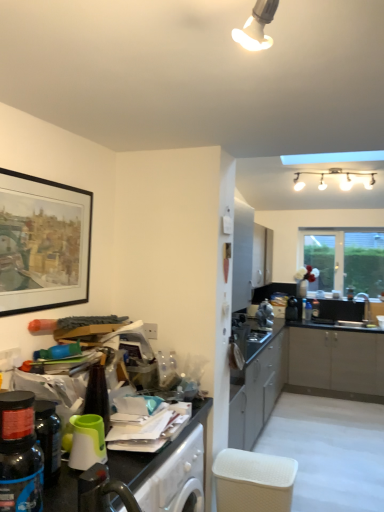
Where is `black plastic toaster at center-right, positioned as the 3th appliance in left-to-right order`? Image resolution: width=384 pixels, height=512 pixels. black plastic toaster at center-right, positioned as the 3th appliance in left-to-right order is located at coordinates (292, 309).

How much space does green plastic cup at lower left, the third appliance positioned from the right, occupy vertically?

green plastic cup at lower left, the third appliance positioned from the right, is 18.29 centimeters in height.

Locate an element on the screen. The width and height of the screenshot is (384, 512). green plastic cup at lower left, the third appliance positioned from the right is located at coordinates (87, 442).

Describe the element at coordinates (265, 314) in the screenshot. This screenshot has width=384, height=512. I see `satin silver toaster at center-right, the second appliance positioned from the left` at that location.

Where is `satin silver toaster at center-right, the second appliance positioned from the left`? Image resolution: width=384 pixels, height=512 pixels. satin silver toaster at center-right, the second appliance positioned from the left is located at coordinates 265,314.

This screenshot has height=512, width=384. Describe the element at coordinates (19, 455) in the screenshot. I see `translucent plastic bottle at lower left` at that location.

The height and width of the screenshot is (512, 384). Describe the element at coordinates (335, 175) in the screenshot. I see `white glossy light fixture at upper right` at that location.

You are a GUI agent. You are given a task and a screenshot of the screen. Output one action in this format:
    pyautogui.click(x=<x>, y=<y>)
    Task: Click on the black plastic toaster at center-right, the 3th appliance when ordered from front to back
    This screenshot has height=512, width=384.
    Given the screenshot: What is the action you would take?
    pyautogui.click(x=292, y=309)

Between translucent plastic bottle at lower left and green plastic cup at lower left, placed as the third appliance when sorted from back to front, which one has larger size?

With larger size is translucent plastic bottle at lower left.

Between translucent plastic bottle at lower left and green plastic cup at lower left, the third appliance positioned from the right, which one has less height?

With less height is green plastic cup at lower left, the third appliance positioned from the right.

In the scene shown: Can you see translucent plastic bottle at lower left touching green plastic cup at lower left, marked as the first appliance in a left-to-right arrangement?

No, translucent plastic bottle at lower left is not in contact with green plastic cup at lower left, marked as the first appliance in a left-to-right arrangement.

Is point (358, 271) more distant than point (296, 316)?

That is True.

From the image's perspective, does clear glass window at upper right appear lower than black plastic toaster at center-right, the 3th appliance when ordered from front to back?

Actually, clear glass window at upper right appears above black plastic toaster at center-right, the 3th appliance when ordered from front to back, in the image.

Is clear glass window at upper right oriented towards black plastic toaster at center-right, which is the 1th appliance in back-to-front order?

Yes.

Is clear glass window at upper right shorter than black plastic toaster at center-right, which is the 1th appliance in back-to-front order?

Incorrect, the height of clear glass window at upper right does not fall short of that of black plastic toaster at center-right, which is the 1th appliance in back-to-front order.

Which object is thinner, white glossy light fixture at upper right or black matte picture frame at left?

Thinner between the two is black matte picture frame at left.

Relative to black matte picture frame at left, is white glossy light fixture at upper right in front or behind?

Visually, white glossy light fixture at upper right is located behind black matte picture frame at left.

Looking at this image, considering the relative positions of white glossy light fixture at upper right and black matte picture frame at left in the image provided, is white glossy light fixture at upper right to the left of black matte picture frame at left from the viewer's perspective?

No, white glossy light fixture at upper right is not to the left of black matte picture frame at left.

Based on the photo, is black matte picture frame at left surrounded by white glossy light fixture at upper right?

No, white glossy light fixture at upper right does not contain black matte picture frame at left.

Based on the photo, is satin silver toaster at center-right, which is the second appliance from back to front, oriented towards green plastic cup at lower left, arranged as the 1th appliance when viewed from the front?

No, satin silver toaster at center-right, which is the second appliance from back to front, is not aimed at green plastic cup at lower left, arranged as the 1th appliance when viewed from the front.

From the picture: Which point is more distant from viewer, (257, 316) or (92, 423)?

The point (257, 316) is more distant.

Can you confirm if satin silver toaster at center-right, the second appliance positioned from the left, is wider than green plastic cup at lower left, marked as the first appliance in a left-to-right arrangement?

Yes, satin silver toaster at center-right, the second appliance positioned from the left, is wider than green plastic cup at lower left, marked as the first appliance in a left-to-right arrangement.

Which of these two, white textured basket at lower center or black matte picture frame at left, stands shorter?

With less height is white textured basket at lower center.

Is black matte picture frame at left inside white textured basket at lower center?

That's incorrect, black matte picture frame at left is not inside white textured basket at lower center.

From the image's perspective, relative to black matte picture frame at left, is white textured basket at lower center above or below?

Clearly, from the image's perspective, white textured basket at lower center is below black matte picture frame at left.

Is point (239, 475) farther from viewer compared to point (68, 223)?

Yes, point (239, 475) is behind point (68, 223).

Are white glossy light fixture at upper right and white textured basket at lower center beside each other?

They are not placed beside each other.

From the picture: Which is less distant, (336, 170) or (235, 482)?

Point (336, 170) appears to be farther away from the viewer than point (235, 482).

Does white glossy light fixture at upper right have a lesser height compared to white textured basket at lower center?

Indeed, white glossy light fixture at upper right has a lesser height compared to white textured basket at lower center.

Which is more to the left, white glossy light fixture at upper right or white textured basket at lower center?

Positioned to the left is white textured basket at lower center.

Can you see black matte picture frame at left touching translucent plastic bottle at lower left?

black matte picture frame at left is not next to translucent plastic bottle at lower left, and they're not touching.

From a real-world perspective, which object stands above the other?

black matte picture frame at left is physically above.

Is black matte picture frame at left situated inside translucent plastic bottle at lower left or outside?

black matte picture frame at left lies outside translucent plastic bottle at lower left.

Could you tell me if black matte picture frame at left is turned towards translucent plastic bottle at lower left?

No, black matte picture frame at left does not turn towards translucent plastic bottle at lower left.

The height and width of the screenshot is (512, 384). Find the location of `bottle in front of the green plastic cup at lower left, arranged as the 1th appliance when viewed from the front`. bottle in front of the green plastic cup at lower left, arranged as the 1th appliance when viewed from the front is located at coordinates pos(19,455).

Image resolution: width=384 pixels, height=512 pixels. Identify the location of the 2nd appliance positioned below the clear glass window at upper right (from a real-world perspective). (292, 309).

Which object lies nearer to the anchor point black matte picture frame at left, satin silver toaster at center-right, which ranks as the 2th appliance in right-to-left order, or green plastic cup at lower left, marked as the first appliance in a left-to-right arrangement?

Based on the image, green plastic cup at lower left, marked as the first appliance in a left-to-right arrangement, appears to be nearer to black matte picture frame at left.

Looking at the image, which one is located further to white glossy light fixture at upper right, satin silver toaster at center-right, the second appliance positioned from the left, or black matte picture frame at left?

The object further to white glossy light fixture at upper right is black matte picture frame at left.

Estimate the real-world distances between objects in this image. Which object is closer to green plastic cup at lower left, the third appliance positioned from the right, black plastic toaster at center-right, positioned as the 3th appliance in left-to-right order, or white textured basket at lower center?

Among the two, white textured basket at lower center is located nearer to green plastic cup at lower left, the third appliance positioned from the right.

Which object lies nearer to the anchor point satin silver toaster at center-right, the 2th appliance viewed from the front, black matte picture frame at left or white glossy light fixture at upper right?

Based on the image, white glossy light fixture at upper right appears to be nearer to satin silver toaster at center-right, the 2th appliance viewed from the front.

Based on their spatial positions, is satin silver toaster at center-right, the second appliance positioned from the left, or green plastic cup at lower left, placed as the third appliance when sorted from back to front, closer to translucent plastic bottle at lower left?

Based on the image, green plastic cup at lower left, placed as the third appliance when sorted from back to front, appears to be nearer to translucent plastic bottle at lower left.

Based on their spatial positions, is black plastic toaster at center-right, the 3th appliance when ordered from front to back, or green plastic cup at lower left, marked as the first appliance in a left-to-right arrangement, further from black matte picture frame at left?

The object further to black matte picture frame at left is black plastic toaster at center-right, the 3th appliance when ordered from front to back.

From the picture: Which object lies further to the anchor point translucent plastic bottle at lower left, white glossy light fixture at upper right or white textured basket at lower center?

The object further to translucent plastic bottle at lower left is white glossy light fixture at upper right.

Which object lies further to the anchor point white glossy light fixture at upper right, black plastic toaster at center-right, the 1th appliance when ordered from right to left, or white textured basket at lower center?

white textured basket at lower center is further to white glossy light fixture at upper right.

I want to click on picture frame between green plastic cup at lower left, the third appliance positioned from the right, and white glossy light fixture at upper right, along the z-axis, so click(42, 243).

Find the location of `chair located between black matte picture frame at left and black plastic toaster at center-right, positioned as the 3th appliance in left-to-right order, in the depth direction`. chair located between black matte picture frame at left and black plastic toaster at center-right, positioned as the 3th appliance in left-to-right order, in the depth direction is located at coordinates (253, 481).

Identify the location of light fixture between black matte picture frame at left and black plastic toaster at center-right, the 1th appliance when ordered from right to left, along the z-axis. (335, 175).

Image resolution: width=384 pixels, height=512 pixels. What are the coordinates of `picture frame located between green plastic cup at lower left, the third appliance positioned from the right, and clear glass window at upper right in the depth direction` in the screenshot? It's located at (42, 243).